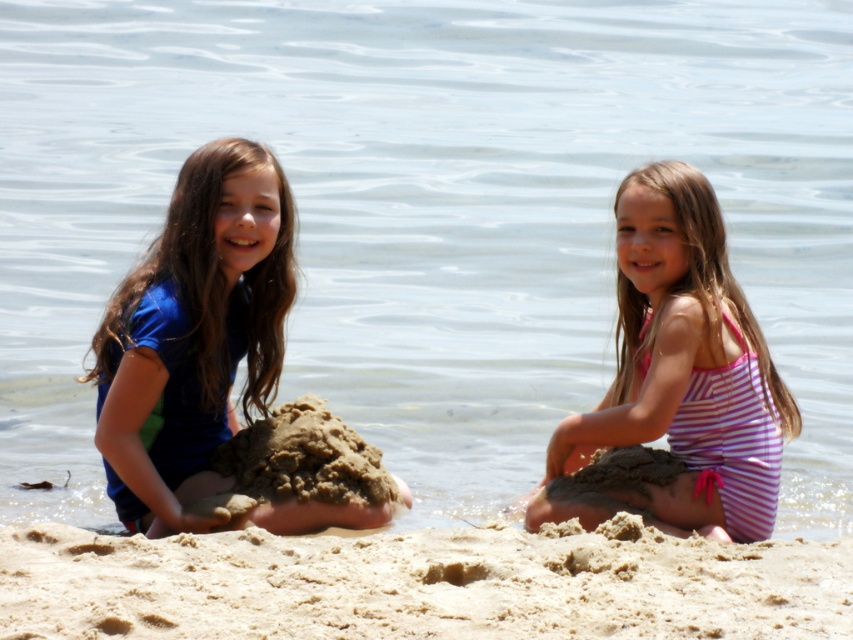
Consider the image. You are a photographer trying to capture the pink striped swimsuit at center in the image. Given that the coordinate system starts at the bottom left corner of the image, can you confirm if the point marked at (679, 376) is the correct location for the pink striped swimsuit at center?

Yes, the point marked at (679, 376) is the correct location for the pink striped swimsuit at center as stated in the description.